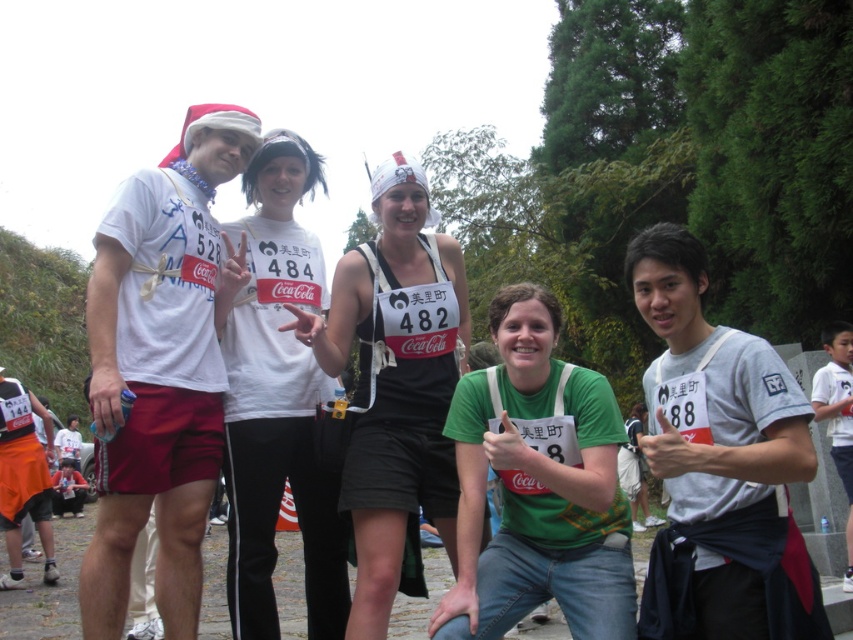
Can you confirm if gray fabric shirt at center is positioned to the right of green matte shirt at center?

Indeed, gray fabric shirt at center is positioned on the right side of green matte shirt at center.

How far apart are gray fabric shirt at center and green matte shirt at center?

gray fabric shirt at center is 4.45 feet away from green matte shirt at center.

Between point (666, 564) and point (573, 508), which one is positioned behind?

Positioned behind is point (573, 508).

Locate an element on the screen. Image resolution: width=853 pixels, height=640 pixels. gray fabric shirt at center is located at coordinates (718, 465).

Is the position of white t-shirt at center less distant than that of black fabric tank top at center?

That is False.

Can you confirm if white t-shirt at center is taller than black fabric tank top at center?

Indeed, white t-shirt at center has a greater height compared to black fabric tank top at center.

You are a GUI agent. You are given a task and a screenshot of the screen. Output one action in this format:
    pyautogui.click(x=<x>, y=<y>)
    Task: Click on the white t-shirt at center
    Image resolution: width=853 pixels, height=640 pixels.
    Given the screenshot: What is the action you would take?
    pyautogui.click(x=161, y=365)

Does point (732, 467) come closer to viewer compared to point (386, 604)?

That is True.

How much distance is there between gray fabric shirt at center and black fabric tank top at center?

They are 3.23 meters apart.

Identify the location of gray fabric shirt at center. (718, 465).